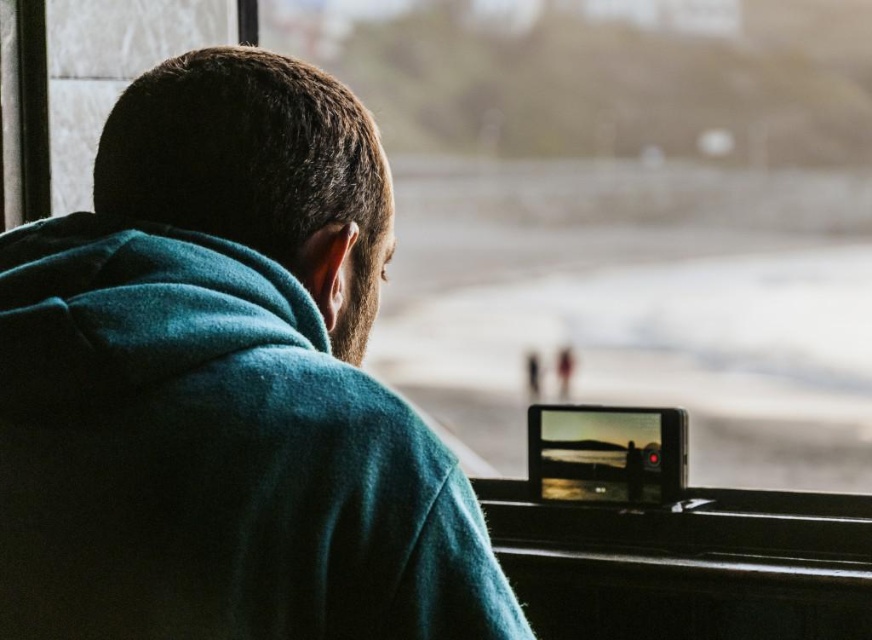
Question: Is teal fleece jacket at upper left to the left of transparent glass train window at center from the viewer's perspective?

Choices:
 (A) yes
 (B) no

Answer: (A)

Question: Can you confirm if teal fleece jacket at upper left is bigger than transparent glass train window at center?

Choices:
 (A) no
 (B) yes

Answer: (A)

Question: Which of the following is the closest to the observer?

Choices:
 (A) (5, 500)
 (B) (535, 317)

Answer: (A)

Question: Is teal fleece jacket at upper left above transparent glass train window at center?

Choices:
 (A) no
 (B) yes

Answer: (A)

Question: Which point appears farthest from the camera in this image?

Choices:
 (A) (465, 500)
 (B) (571, 392)

Answer: (B)